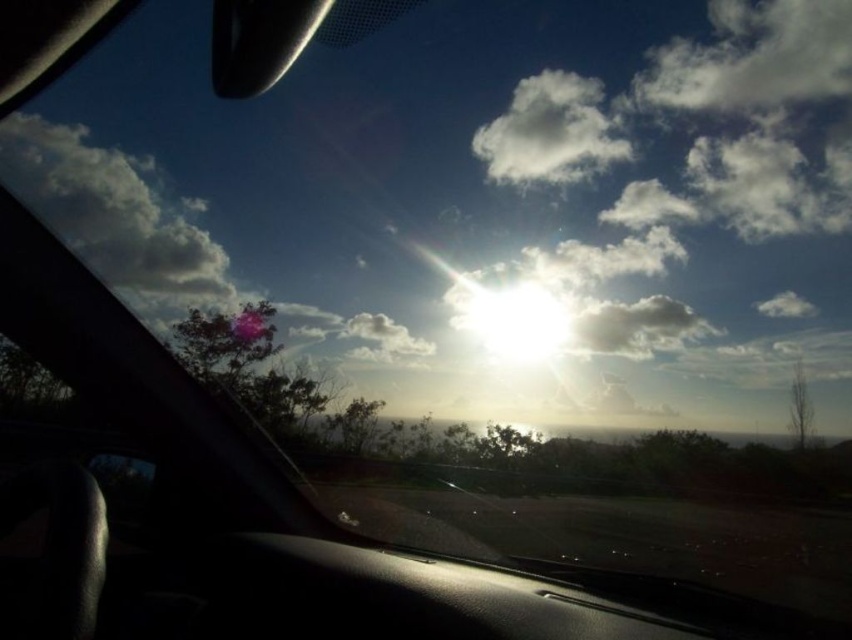
You are a photographer adjusting your camera to capture the scenic view through the windshield. You notice two white fluffy clouds in the sky. Which one, the white fluffy cloud at upper left or the white fluffy cloud at upper center, appears larger in height in the photo?

The white fluffy cloud at upper left appears larger in height because it is much taller than the white fluffy cloud at upper center according to the description.

You are a photographer trying to capture the white fluffy cloud at upper right and the white fluffy cloud at upper center in a single shot. Which cloud is positioned higher in the frame?

The white fluffy cloud at upper right is taller than the white fluffy cloud at upper center, so it is positioned higher in the frame.